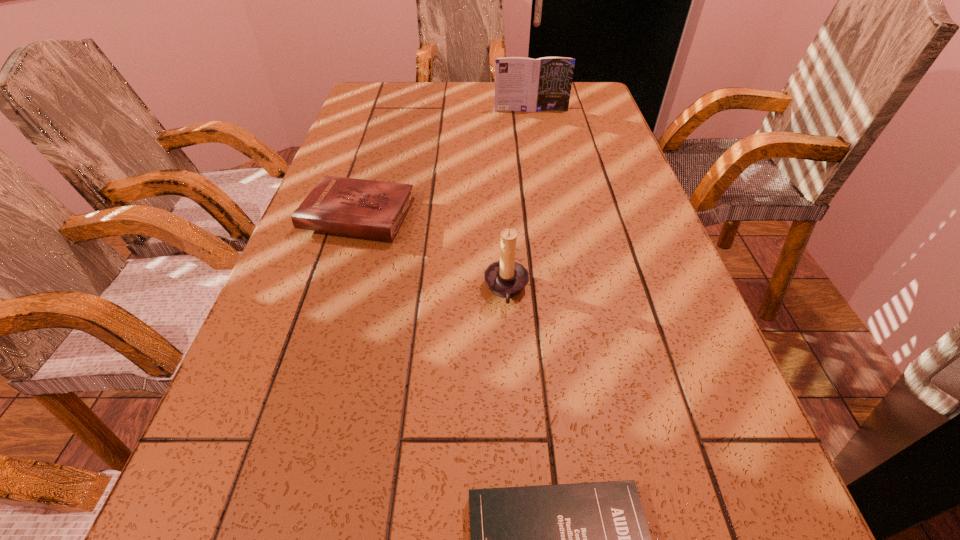
The image size is (960, 540). Identify the location of free space between the candle holder and the farther book. coord(518,200).

The width and height of the screenshot is (960, 540). In order to click on free space between the candle holder and the third nearest object in this screenshot , I will do `click(432, 253)`.

You are a GUI agent. You are given a task and a screenshot of the screen. Output one action in this format:
    pyautogui.click(x=<x>, y=<y>)
    Task: Click on the free space between the farther book and the hardback book
    This screenshot has width=960, height=540.
    Given the screenshot: What is the action you would take?
    pyautogui.click(x=444, y=163)

This screenshot has height=540, width=960. Identify the location of vacant point located between the farther book and the second shortest object. (444, 163).

Identify the location of object that stands as the closest to the second nearest object. (372, 209).

Identify which object is located as the nearest to the hardback book. Please provide its 2D coordinates. Your answer should be formatted as a tuple, i.e. [(x, y)], where the tuple contains the x and y coordinates of a point satisfying the conditions above.

[(506, 278)]